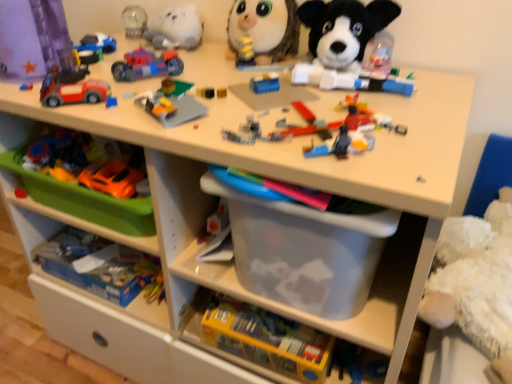
Identify the location of free space between translucent plastic motorcycle at upper center, which ranks as the 6th toy in bottom-to-top order, and soft plush dog at upper center, which is the seventh toy from bottom to top. (241, 79).